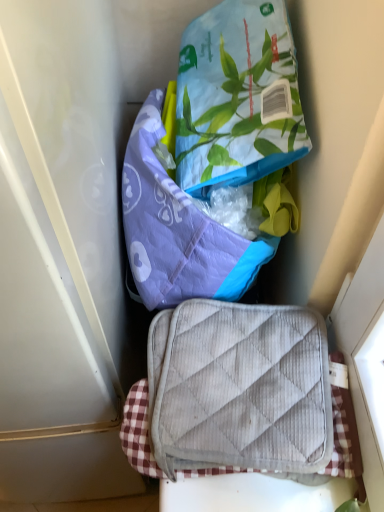
This screenshot has width=384, height=512. What do you see at coordinates (178, 230) in the screenshot?
I see `purple quilted pouch at center, placed as the first pouch when sorted from bottom to top` at bounding box center [178, 230].

Locate an element on the screen. This screenshot has width=384, height=512. purple quilted pouch at center, placed as the second pouch when sorted from top to bottom is located at coordinates (178, 230).

Based on their sizes in the image, would you say gray quilted suitcase at center is bigger or smaller than printed fabric pouch at upper center, the 1th pouch in the top-to-bottom sequence?

Clearly, gray quilted suitcase at center is smaller in size than printed fabric pouch at upper center, the 1th pouch in the top-to-bottom sequence.

From a real-world perspective, is gray quilted suitcase at center on printed fabric pouch at upper center, which appears as the second pouch when ordered from the bottom?

Incorrect, from a real-world perspective, gray quilted suitcase at center is lower than printed fabric pouch at upper center, which appears as the second pouch when ordered from the bottom.

How different are the orientations of gray quilted suitcase at center and printed fabric pouch at upper center, which appears as the second pouch when ordered from the bottom, in degrees?

89.2 degrees separate the facing orientations of gray quilted suitcase at center and printed fabric pouch at upper center, which appears as the second pouch when ordered from the bottom.

How different are the orientations of printed fabric pouch at upper center, which appears as the second pouch when ordered from the bottom, and purple quilted pouch at center, placed as the first pouch when sorted from bottom to top, in degrees?

0.795 degrees separate the facing orientations of printed fabric pouch at upper center, which appears as the second pouch when ordered from the bottom, and purple quilted pouch at center, placed as the first pouch when sorted from bottom to top.

Does point (240, 47) lie in front of point (137, 170)?

Yes, it is.

Who is bigger, printed fabric pouch at upper center, the 1th pouch in the top-to-bottom sequence, or purple quilted pouch at center, placed as the second pouch when sorted from top to bottom?

purple quilted pouch at center, placed as the second pouch when sorted from top to bottom.

From the picture: Which is more to the right, printed fabric pouch at upper center, which appears as the second pouch when ordered from the bottom, or purple quilted pouch at center, placed as the first pouch when sorted from bottom to top?

printed fabric pouch at upper center, which appears as the second pouch when ordered from the bottom, is more to the right.

Is printed fabric pouch at upper center, the 1th pouch in the top-to-bottom sequence, turned away from gray quilted suitcase at center?

No, printed fabric pouch at upper center, the 1th pouch in the top-to-bottom sequence, is not facing away from gray quilted suitcase at center.

Measure the distance between printed fabric pouch at upper center, the 1th pouch in the top-to-bottom sequence, and gray quilted suitcase at center.

A distance of 27.37 centimeters exists between printed fabric pouch at upper center, the 1th pouch in the top-to-bottom sequence, and gray quilted suitcase at center.

Who is bigger, printed fabric pouch at upper center, the 1th pouch in the top-to-bottom sequence, or gray quilted suitcase at center?

printed fabric pouch at upper center, the 1th pouch in the top-to-bottom sequence.

Is printed fabric pouch at upper center, which appears as the second pouch when ordered from the bottom, taller than gray quilted suitcase at center?

Yes, printed fabric pouch at upper center, which appears as the second pouch when ordered from the bottom, is taller than gray quilted suitcase at center.

Is gray quilted suitcase at center not near purple quilted pouch at center, placed as the first pouch when sorted from bottom to top?

No, gray quilted suitcase at center is in close proximity to purple quilted pouch at center, placed as the first pouch when sorted from bottom to top.

From the picture: Is gray quilted suitcase at center smaller than purple quilted pouch at center, placed as the second pouch when sorted from top to bottom?

Yes, gray quilted suitcase at center is smaller than purple quilted pouch at center, placed as the second pouch when sorted from top to bottom.

From a real-world perspective, who is located higher, gray quilted suitcase at center or purple quilted pouch at center, placed as the first pouch when sorted from bottom to top?

purple quilted pouch at center, placed as the first pouch when sorted from bottom to top, is physically above.

This screenshot has height=512, width=384. In order to click on pouch in front of the purple quilted pouch at center, placed as the second pouch when sorted from top to bottom in this screenshot , I will do `click(235, 97)`.

Who is bigger, purple quilted pouch at center, placed as the first pouch when sorted from bottom to top, or printed fabric pouch at upper center, which appears as the second pouch when ordered from the bottom?

Bigger between the two is purple quilted pouch at center, placed as the first pouch when sorted from bottom to top.

From a real-world perspective, is purple quilted pouch at center, placed as the second pouch when sorted from top to bottom, physically below printed fabric pouch at upper center, the 1th pouch in the top-to-bottom sequence?

Yes.

Is purple quilted pouch at center, placed as the second pouch when sorted from top to bottom, further to the viewer compared to printed fabric pouch at upper center, the 1th pouch in the top-to-bottom sequence?

Yes, purple quilted pouch at center, placed as the second pouch when sorted from top to bottom, is behind printed fabric pouch at upper center, the 1th pouch in the top-to-bottom sequence.

Could you tell me if purple quilted pouch at center, placed as the second pouch when sorted from top to bottom, is turned towards gray quilted suitcase at center?

Yes, purple quilted pouch at center, placed as the second pouch when sorted from top to bottom, is oriented towards gray quilted suitcase at center.

Which object is thinner, purple quilted pouch at center, placed as the second pouch when sorted from top to bottom, or gray quilted suitcase at center?

With smaller width is purple quilted pouch at center, placed as the second pouch when sorted from top to bottom.

Consider the image. Is purple quilted pouch at center, placed as the first pouch when sorted from bottom to top, completely or partially outside of gray quilted suitcase at center?

Indeed, purple quilted pouch at center, placed as the first pouch when sorted from bottom to top, is completely outside gray quilted suitcase at center.

Which of these two, purple quilted pouch at center, placed as the second pouch when sorted from top to bottom, or gray quilted suitcase at center, stands shorter?

gray quilted suitcase at center.

At what (x,y) coordinates should I click in order to perform the action: click on luggage and bags located behind the printed fabric pouch at upper center, the 1th pouch in the top-to-bottom sequence. Please return your answer as a coordinate pair (x, y). Image resolution: width=384 pixels, height=512 pixels. Looking at the image, I should click on (239, 388).

What are the coordinates of `pouch lying below the printed fabric pouch at upper center, the 1th pouch in the top-to-bottom sequence (from the image's perspective)` in the screenshot? It's located at (178, 230).

Which object lies nearer to the anchor point purple quilted pouch at center, placed as the second pouch when sorted from top to bottom, printed fabric pouch at upper center, the 1th pouch in the top-to-bottom sequence, or gray quilted suitcase at center?

printed fabric pouch at upper center, the 1th pouch in the top-to-bottom sequence, is positioned closer to the anchor purple quilted pouch at center, placed as the second pouch when sorted from top to bottom.

Considering their positions, is purple quilted pouch at center, placed as the second pouch when sorted from top to bottom, positioned closer to printed fabric pouch at upper center, the 1th pouch in the top-to-bottom sequence, than gray quilted suitcase at center?

Among the two, purple quilted pouch at center, placed as the second pouch when sorted from top to bottom, is located nearer to printed fabric pouch at upper center, the 1th pouch in the top-to-bottom sequence.

Looking at the image, which one is located further to gray quilted suitcase at center, printed fabric pouch at upper center, the 1th pouch in the top-to-bottom sequence, or purple quilted pouch at center, placed as the first pouch when sorted from bottom to top?

Among the two, printed fabric pouch at upper center, the 1th pouch in the top-to-bottom sequence, is located further to gray quilted suitcase at center.

Looking at the image, which one is located further to purple quilted pouch at center, placed as the second pouch when sorted from top to bottom, gray quilted suitcase at center or printed fabric pouch at upper center, which appears as the second pouch when ordered from the bottom?

gray quilted suitcase at center lies further to purple quilted pouch at center, placed as the second pouch when sorted from top to bottom, than the other object.

Looking at the image, which one is located closer to gray quilted suitcase at center, purple quilted pouch at center, placed as the first pouch when sorted from bottom to top, or printed fabric pouch at upper center, which appears as the second pouch when ordered from the bottom?

The object closer to gray quilted suitcase at center is purple quilted pouch at center, placed as the first pouch when sorted from bottom to top.

Estimate the real-world distances between objects in this image. Which object is further from printed fabric pouch at upper center, which appears as the second pouch when ordered from the bottom, gray quilted suitcase at center or purple quilted pouch at center, placed as the first pouch when sorted from bottom to top?

The object further to printed fabric pouch at upper center, which appears as the second pouch when ordered from the bottom, is gray quilted suitcase at center.

You are a GUI agent. You are given a task and a screenshot of the screen. Output one action in this format:
    pyautogui.click(x=<x>, y=<y>)
    Task: Click on the pouch between printed fabric pouch at upper center, the 1th pouch in the top-to-bottom sequence, and gray quilted suitcase at center, in the vertical direction
    
    Given the screenshot: What is the action you would take?
    pyautogui.click(x=178, y=230)